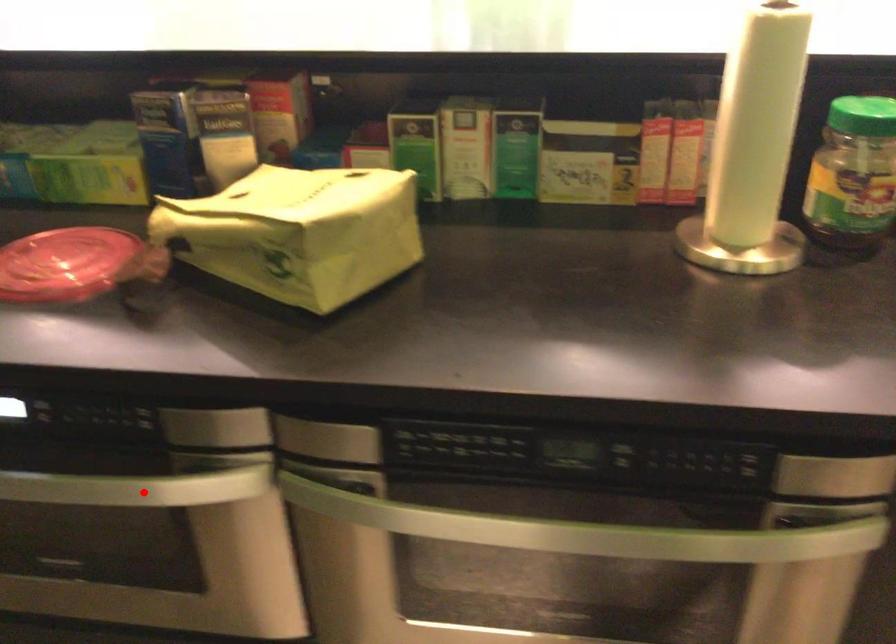
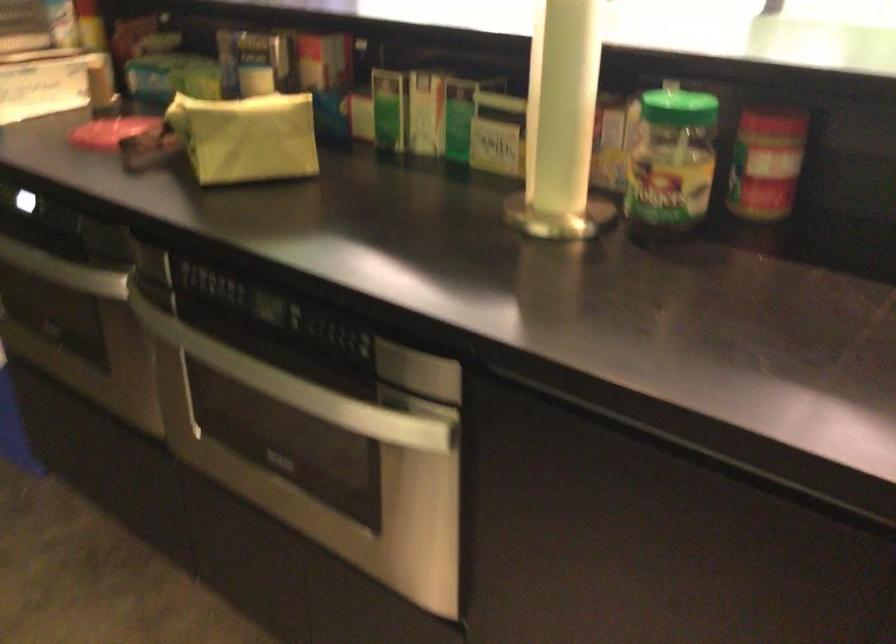
Question: I am providing you with two images of the same scene from different viewpoints. Image1 has a red point marked. In image2, the corresponding 3D location appears at what relative position? Reply with the corresponding letter.

Choices:
 (A) Closer
 (B) Farther

Answer: (B)